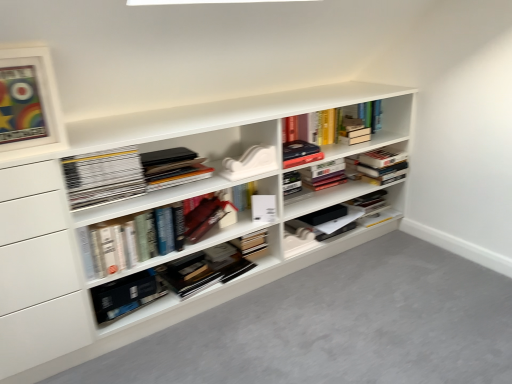
The image size is (512, 384). Identify the location of hardcover book at center. (324, 174).

The image size is (512, 384). I want to click on white matte bookshelf at center, so click(x=153, y=220).

Locate an element on the screen. hardcover books at center, acting as the 3th book starting from the top is located at coordinates (151, 233).

The height and width of the screenshot is (384, 512). Identify the location of hardcover book at center, which is counted as the second paperback book, starting from the top. (126, 295).

What do you see at coordinates (332, 222) in the screenshot?
I see `matte black box at center` at bounding box center [332, 222].

From the picture: What is the approximate width of white matte paperback book at center, the first paperback book viewed from the top?

4.20 inches.

Measure the distance between point (258, 198) and camera.

Point (258, 198) and camera are 6.53 feet apart.

This screenshot has height=384, width=512. Describe the element at coordinates (28, 98) in the screenshot. I see `matte white picture frame at upper left` at that location.

This screenshot has width=512, height=384. I want to click on hardcover book at center, so click(x=324, y=174).

Is white matte bookshelf at center located within hardcover book at center, acting as the second book starting from the bottom?

No.

From a real-world perspective, is hardcover book at center, acting as the second book starting from the bottom, physically below white matte bookshelf at center?

Yes, from a real-world perspective, hardcover book at center, acting as the second book starting from the bottom, is below white matte bookshelf at center.

Consider the image. Considering the relative sizes of hardcover book at center, acting as the second book starting from the bottom, and white matte bookshelf at center in the image provided, is hardcover book at center, acting as the second book starting from the bottom, smaller than white matte bookshelf at center?

Yes.

From the image's perspective, which is above, hardcover book at center, acting as the second book starting from the bottom, or white matte bookshelf at center?

white matte bookshelf at center appears higher in the image.

Looking at this image, does hardcover book at center, which is counted as the second paperback book, starting from the top, have a smaller size compared to hardcover book at center, placed as the second book when sorted from top to bottom?

Incorrect, hardcover book at center, which is counted as the second paperback book, starting from the top, is not smaller in size than hardcover book at center, placed as the second book when sorted from top to bottom.

From the image's perspective, which is below, hardcover book at center, the second paperback book in the right-to-left sequence, or hardcover book at center, acting as the second book starting from the bottom?

hardcover book at center, the second paperback book in the right-to-left sequence.

Starting from the hardcover book at center, the first paperback book when ordered from left to right, which book is the 3rd one to the right? Please provide its 2D coordinates.

[(204, 218)]

Does hardcover books at center, the 1th book in the bottom-to-top sequence, appear on the left side of matte white picture frame at upper left?

No.

Could you measure the distance between hardcover books at center, the 1th book in the bottom-to-top sequence, and matte white picture frame at upper left?

hardcover books at center, the 1th book in the bottom-to-top sequence, and matte white picture frame at upper left are 20.05 inches apart from each other.

Is hardcover books at center, acting as the 3th book starting from the top, facing towards matte white picture frame at upper left?

No, hardcover books at center, acting as the 3th book starting from the top, does not turn towards matte white picture frame at upper left.

From the image's perspective, does hardcover books at center, the 1th book in the bottom-to-top sequence, appear lower than matte white picture frame at upper left?

Yes, from the image's perspective, hardcover books at center, the 1th book in the bottom-to-top sequence, is beneath matte white picture frame at upper left.

Can you confirm if matte white picture frame at upper left is taller than hardcover books at center, acting as the 3th book starting from the top?

Indeed, matte white picture frame at upper left has a greater height compared to hardcover books at center, acting as the 3th book starting from the top.

Between matte white picture frame at upper left and hardcover books at center, the 1th book in the bottom-to-top sequence, which one has larger size?

hardcover books at center, the 1th book in the bottom-to-top sequence.

Which object is closer to the camera, matte white picture frame at upper left or hardcover books at center, the 1th book in the bottom-to-top sequence?

matte white picture frame at upper left is closer to the camera.

Based on the photo, is matte white picture frame at upper left far away from hardcover books at center, acting as the 3th book starting from the top?

Actually, matte white picture frame at upper left and hardcover books at center, acting as the 3th book starting from the top, are a little close together.

From a real-world perspective, is white matte bookshelf at center located higher than hardcover books at center, the 1th book in the bottom-to-top sequence?

Incorrect, from a real-world perspective, white matte bookshelf at center is lower than hardcover books at center, the 1th book in the bottom-to-top sequence.

Can you confirm if white matte bookshelf at center is bigger than hardcover books at center, the 1th book in the bottom-to-top sequence?

Yes.

Considering the sizes of white matte bookshelf at center and hardcover books at center, acting as the 3th book starting from the top, in the image, is white matte bookshelf at center taller or shorter than hardcover books at center, acting as the 3th book starting from the top,?

Clearly, white matte bookshelf at center is taller compared to hardcover books at center, acting as the 3th book starting from the top.

Can you confirm if white matte bookshelf at center is positioned to the right of hardcover books at center, acting as the 3th book starting from the top?

Yes.

Looking at their sizes, would you say matte black book at center, the 3th book from the bottom, is wider or thinner than hardcover book at center?

In the image, matte black book at center, the 3th book from the bottom, appears to be wider than hardcover book at center.

Is matte black book at center, the 3th book from the bottom, inside or outside of hardcover book at center?

The correct answer is: outside.

From a real-world perspective, is matte black book at center, the 3th book from the bottom, positioned under hardcover book at center based on gravity?

Actually, matte black book at center, the 3th book from the bottom, is physically above hardcover book at center in the real world.

Which is less distant, (193, 168) or (325, 168)?

Point (193, 168) is closer to the camera than point (325, 168).

Based on the photo, relative to white matte bookshelf at center, is hardcover book at center, the first paperback book when ordered from left to right, in front or behind?

hardcover book at center, the first paperback book when ordered from left to right, is positioned farther from the viewer than white matte bookshelf at center.

Would you say white matte bookshelf at center is part of hardcover book at center, the second paperback book in the right-to-left sequence,'s contents?

No.

Locate an element on the screen. The height and width of the screenshot is (384, 512). shelf above the hardcover book at center, placed as the second book when sorted from top to bottom (from the image's perspective) is located at coordinates (153, 220).

The image size is (512, 384). Find the location of `paperback book on the left of the hardcover book at center, placed as the second book when sorted from top to bottom`. paperback book on the left of the hardcover book at center, placed as the second book when sorted from top to bottom is located at coordinates (126, 295).

Based on their spatial positions, is hardcover book at center, the first paperback book when ordered from left to right, or white matte bookshelf at center closer to hardcover book at center, placed as the second book when sorted from top to bottom?

hardcover book at center, the first paperback book when ordered from left to right, is closer to hardcover book at center, placed as the second book when sorted from top to bottom.

Based on their spatial positions, is matte white picture frame at upper left or white matte bookshelf at center further from matte black book at center, the 3th book from the bottom?

matte white picture frame at upper left is further to matte black book at center, the 3th book from the bottom.

Considering their positions, is white matte paperback book at center, the 2th paperback book ordered from the bottom, positioned closer to matte white picture frame at upper left than hardcover book at center, the second paperback book in the right-to-left sequence?

The object closer to matte white picture frame at upper left is hardcover book at center, the second paperback book in the right-to-left sequence.

Based on their spatial positions, is matte black book at center, the 3th book from the bottom, or matte black box at center closer to hardcover book at center?

matte black box at center is positioned closer to the anchor hardcover book at center.

Which object lies further to the anchor point white matte paperback book at center, the second paperback book in the left-to-right sequence, hardcover book at center, positioned as the 1th paperback book in bottom-to-top order, or matte white picture frame at upper left?

The object further to white matte paperback book at center, the second paperback book in the left-to-right sequence, is matte white picture frame at upper left.

Estimate the real-world distances between objects in this image. Which object is further from hardcover book at center, the first paperback book when ordered from left to right, matte black book at center, the 3th book from the bottom, or matte black box at center?

matte black box at center lies further to hardcover book at center, the first paperback book when ordered from left to right, than the other object.

Looking at the image, which one is located closer to matte white picture frame at upper left, hardcover books at center, the 1th book in the bottom-to-top sequence, or matte black box at center?

Among the two, hardcover books at center, the 1th book in the bottom-to-top sequence, is located nearer to matte white picture frame at upper left.

Estimate the real-world distances between objects in this image. Which object is further from matte black box at center, white matte paperback book at center, positioned as the 1th paperback book in right-to-left order, or hardcover book at center, the second paperback book in the right-to-left sequence?

Among the two, hardcover book at center, the second paperback book in the right-to-left sequence, is located further to matte black box at center.

The width and height of the screenshot is (512, 384). Identify the location of shelf between matte white picture frame at upper left and white matte paperback book at center, the first paperback book viewed from the top, from front to back. (153, 220).

Find the location of a particular element. shelf that lies between matte white picture frame at upper left and hardcover book at center, positioned as the 1th paperback book in bottom-to-top order, from top to bottom is located at coordinates (153, 220).

The image size is (512, 384). I want to click on book situated between matte black book at center, which ranks as the first book in top-to-bottom order, and hardcover book at center from left to right, so click(204, 218).

At what (x,y) coordinates should I click in order to perform the action: click on book between white matte bookshelf at center and hardcover book at center, the first paperback book when ordered from left to right, from front to back. Please return your answer as a coordinate pair (x, y). Image resolution: width=512 pixels, height=384 pixels. Looking at the image, I should click on (151, 233).